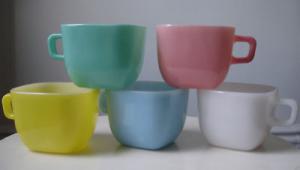
Locate an element on the screen. The image size is (300, 170). yellow cup is located at coordinates (62, 111).